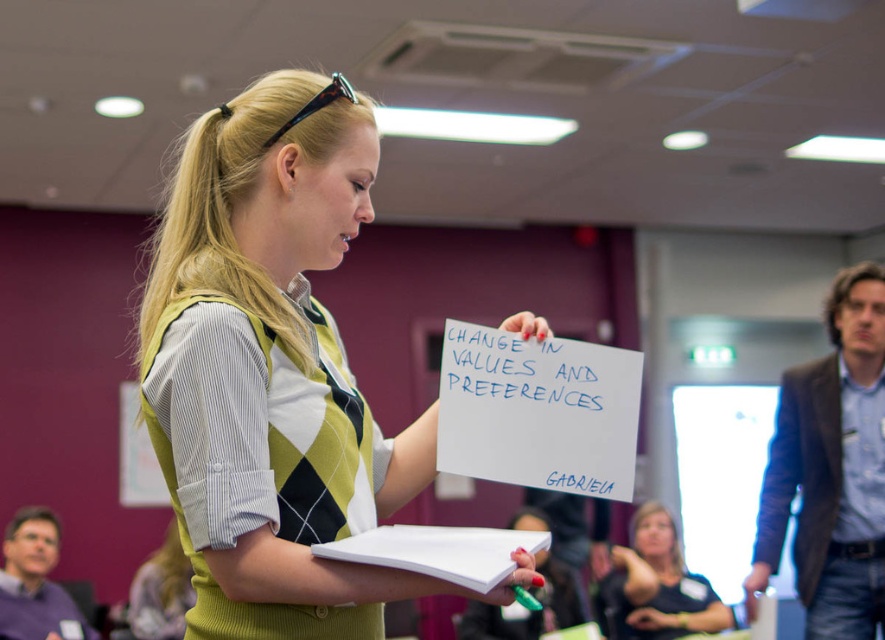
Question: Which of the following is the farthest from the observer?

Choices:
 (A) (645, 513)
 (B) (478, 340)
 (C) (276, 268)

Answer: (A)

Question: Considering the real-world distances, which object is closest to the green argyle sweater vest at center?

Choices:
 (A) blonde hair at center
 (B) blue marker writing at center

Answer: (B)

Question: Which object is the farthest from the green argyle sweater vest at center?

Choices:
 (A) blonde hair at center
 (B) blue marker writing at center

Answer: (A)

Question: Can you confirm if green argyle sweater vest at center is positioned to the left of blonde hair at center?

Choices:
 (A) no
 (B) yes

Answer: (B)

Question: Can you confirm if green argyle sweater vest at center is smaller than blue marker writing at center?

Choices:
 (A) yes
 (B) no

Answer: (B)

Question: Considering the relative positions of green argyle sweater vest at center and blue marker writing at center in the image provided, where is green argyle sweater vest at center located with respect to blue marker writing at center?

Choices:
 (A) left
 (B) right

Answer: (A)